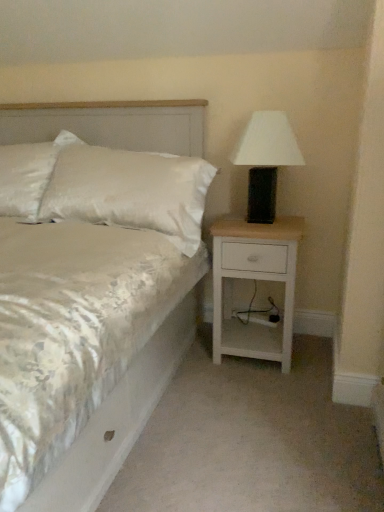
Question: Is satin white pillow at upper left in front of or behind white matte table lamp at right in the image?

Choices:
 (A) front
 (B) behind

Answer: (B)

Question: Is satin white pillow at upper left spatially inside white matte table lamp at right, or outside of it?

Choices:
 (A) inside
 (B) outside

Answer: (B)

Question: Which object is the farthest from the white matte table lamp at right?

Choices:
 (A) white satin bed at center
 (B) satin white pillow at upper left
 (C) white wood nightstand at right

Answer: (B)

Question: Estimate the real-world distances between objects in this image. Which object is farther from the satin white pillow at upper left?

Choices:
 (A) white wood nightstand at right
 (B) white satin bed at center
 (C) white matte table lamp at right

Answer: (A)